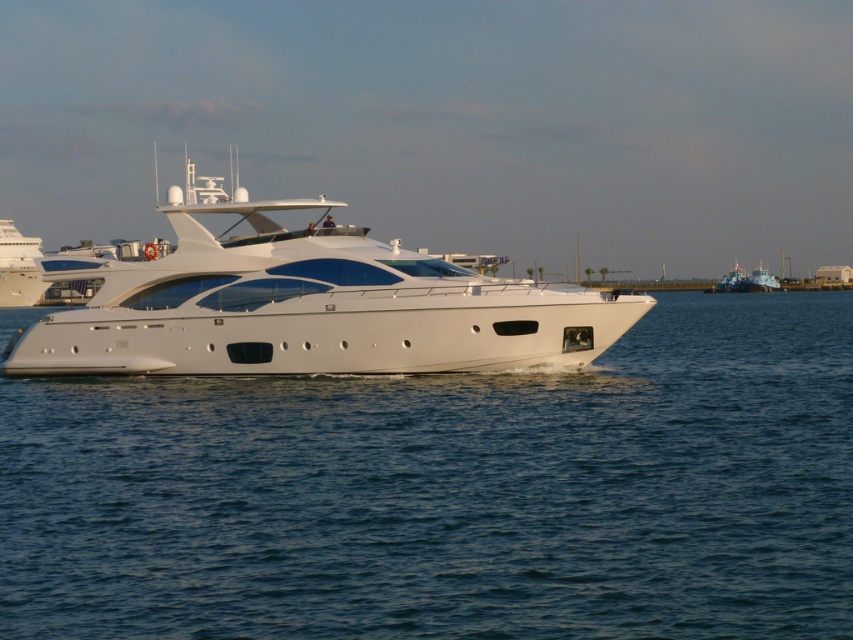
Question: Which object is farther from the camera taking this photo?

Choices:
 (A) metallic gray boat at right
 (B) white glossy yacht at center
 (C) blue matte boat at right
 (D) clear blue water at center

Answer: (A)

Question: Can you confirm if white glossy yacht at left is positioned above metallic gray boat at right?

Choices:
 (A) no
 (B) yes

Answer: (B)

Question: Which point is farther from the camera taking this photo?

Choices:
 (A) (7, 262)
 (B) (563, 288)

Answer: (A)

Question: Which point appears farthest from the camera in this image?

Choices:
 (A) (756, 282)
 (B) (724, 284)
 (C) (749, 563)

Answer: (B)

Question: Does clear blue water at center appear on the left side of blue matte boat at right?

Choices:
 (A) yes
 (B) no

Answer: (A)

Question: Is clear blue water at center smaller than white glossy yacht at left?

Choices:
 (A) yes
 (B) no

Answer: (B)